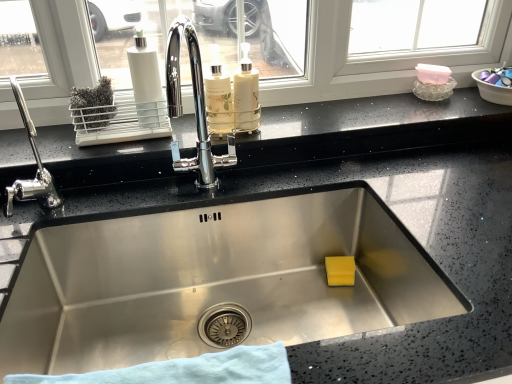
Question: Is blue cloth at bottom touching white matte bottle at center, positioned as the second bottle in left-to-right order?

Choices:
 (A) yes
 (B) no

Answer: (B)

Question: Is blue cloth at bottom positioned behind white matte bottle at center, which is the 1th bottle from right to left?

Choices:
 (A) yes
 (B) no

Answer: (B)

Question: Is blue cloth at bottom in front of white matte bottle at center, positioned as the second bottle in left-to-right order?

Choices:
 (A) yes
 (B) no

Answer: (A)

Question: Does blue cloth at bottom have a larger size compared to white matte bottle at center, which is the 1th bottle from right to left?

Choices:
 (A) no
 (B) yes

Answer: (B)

Question: Does blue cloth at bottom have a smaller size compared to white matte bottle at center, positioned as the second bottle in left-to-right order?

Choices:
 (A) yes
 (B) no

Answer: (B)

Question: Considering the relative sizes of blue cloth at bottom and white matte bottle at center, positioned as the second bottle in left-to-right order, in the image provided, is blue cloth at bottom taller than white matte bottle at center, positioned as the second bottle in left-to-right order,?

Choices:
 (A) yes
 (B) no

Answer: (B)

Question: Is blue cloth at bottom with translucent glass bottle at center, arranged as the 1th bottle when viewed from the left?

Choices:
 (A) yes
 (B) no

Answer: (B)

Question: Does blue cloth at bottom contain translucent glass bottle at center, positioned as the second bottle in right-to-left order?

Choices:
 (A) yes
 (B) no

Answer: (B)

Question: Is the depth of blue cloth at bottom less than that of translucent glass bottle at center, positioned as the second bottle in right-to-left order?

Choices:
 (A) no
 (B) yes

Answer: (B)

Question: Is translucent glass bottle at center, arranged as the 1th bottle when viewed from the left, at the back of blue cloth at bottom?

Choices:
 (A) yes
 (B) no

Answer: (B)

Question: Is blue cloth at bottom positioned behind translucent glass bottle at center, positioned as the second bottle in right-to-left order?

Choices:
 (A) yes
 (B) no

Answer: (B)

Question: Does blue cloth at bottom have a greater width compared to translucent glass bottle at center, arranged as the 1th bottle when viewed from the left?

Choices:
 (A) no
 (B) yes

Answer: (B)

Question: Does blue cloth at bottom have a smaller size compared to chrome metallic faucet at left?

Choices:
 (A) yes
 (B) no

Answer: (A)